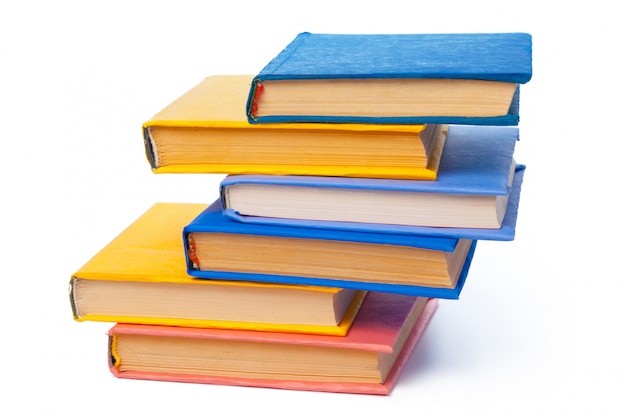
Find the location of `books`. books is located at coordinates (347, 85), (217, 142), (359, 204), (289, 261), (193, 299), (240, 366).